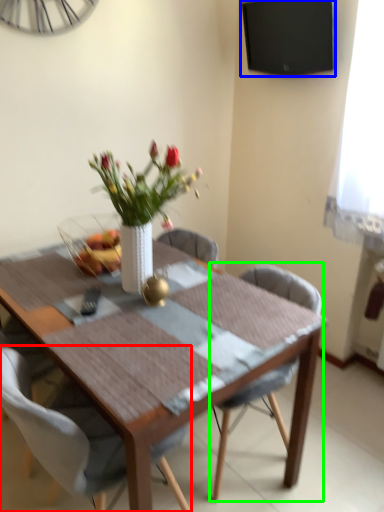
Question: Which is farther away from chair (highlighted by a red box)? television (highlighted by a blue box) or chair (highlighted by a green box)?

Choices:
 (A) television
 (B) chair

Answer: (A)